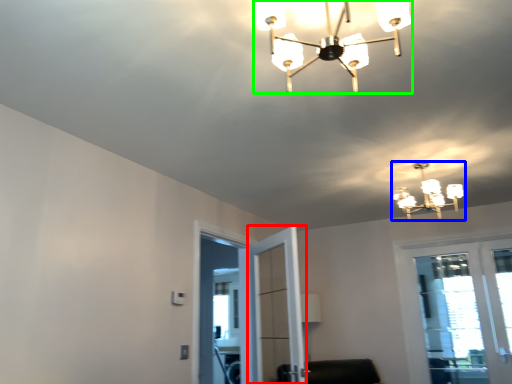
Question: Which object is positioned farthest from screen door (highlighted by a red box)? Select from lamp (highlighted by a blue box) and lamp (highlighted by a green box).

Choices:
 (A) lamp
 (B) lamp

Answer: (B)